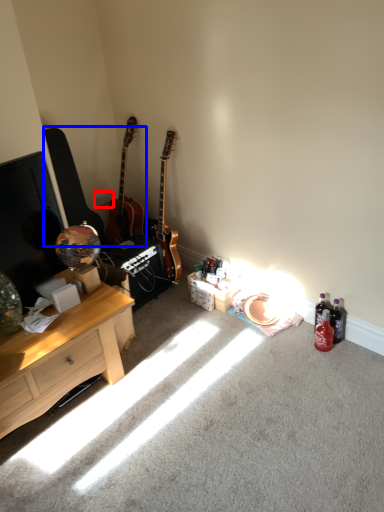
Question: Among these objects, which one is farthest to the camera, power outlet (highlighted by a red box) or guitars (highlighted by a blue box)?

Choices:
 (A) power outlet
 (B) guitars

Answer: (A)